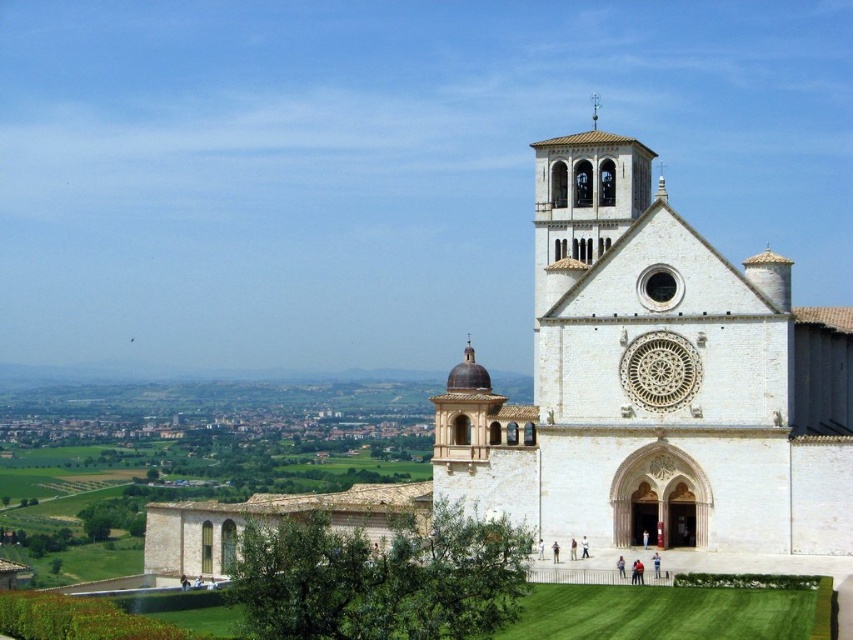
Question: Can you confirm if white stone church at right is positioned to the left of polished silver spire at upper center?

Choices:
 (A) no
 (B) yes

Answer: (B)

Question: In this image, where is white stone church at right located relative to polished silver spire at upper center?

Choices:
 (A) right
 (B) left

Answer: (B)

Question: Which point is farther to the camera?

Choices:
 (A) (596, 100)
 (B) (668, 288)

Answer: (A)

Question: From the image, what is the correct spatial relationship of white stone church at right in relation to polished silver spire at upper center?

Choices:
 (A) above
 (B) below

Answer: (B)